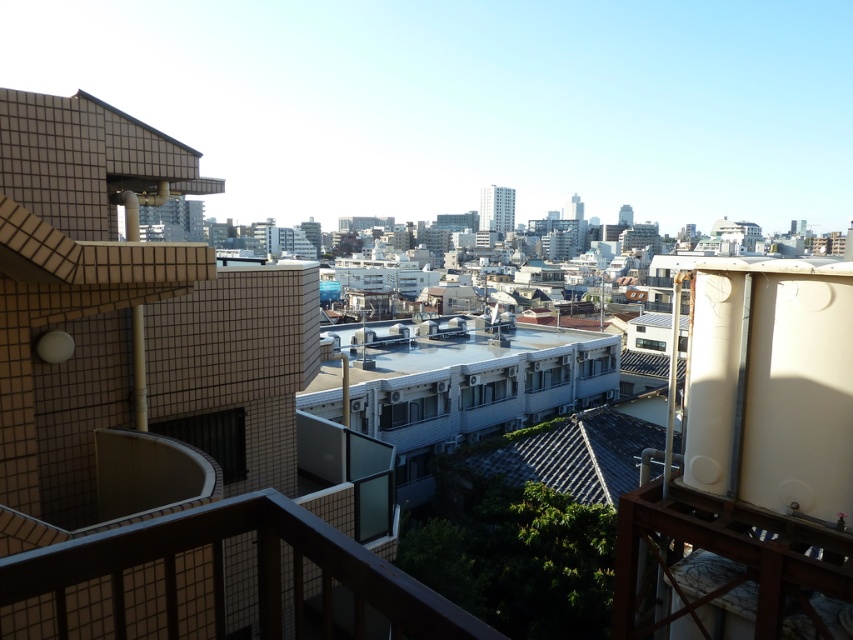
You are a GUI agent. You are given a task and a screenshot of the screen. Output one action in this format:
    pyautogui.click(x=<x>, y=<y>)
    Task: Click on the white smooth roof at center
    This screenshot has height=640, width=853.
    Given the screenshot: What is the action you would take?
    pyautogui.click(x=462, y=368)

Between point (514, 410) and point (677, 413), which one is positioned in front?

Point (677, 413)

I want to click on white smooth roof at center, so click(x=462, y=368).